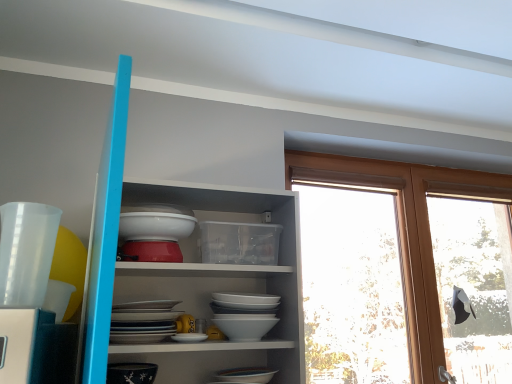
Question: Would you say black glossy bowl at lower left, which appears as the 2th tableware when viewed from the top, is outside white glossy shelves at upper center?

Choices:
 (A) no
 (B) yes

Answer: (A)

Question: Can you confirm if black glossy bowl at lower left, the second tableware in the front-to-back sequence, is thinner than white glossy shelves at upper center?

Choices:
 (A) no
 (B) yes

Answer: (B)

Question: Can you confirm if black glossy bowl at lower left, which appears as the 2th tableware when viewed from the top, is wider than white glossy shelves at upper center?

Choices:
 (A) no
 (B) yes

Answer: (A)

Question: Does black glossy bowl at lower left, the second tableware in the front-to-back sequence, have a greater height compared to white glossy shelves at upper center?

Choices:
 (A) no
 (B) yes

Answer: (A)

Question: Is black glossy bowl at lower left, the second tableware in the front-to-back sequence, at the right side of white glossy shelves at upper center?

Choices:
 (A) yes
 (B) no

Answer: (B)

Question: Considering the relative positions of transparent glass window at upper right and white glossy bowl at center in the image provided, is transparent glass window at upper right to the left or to the right of white glossy bowl at center?

Choices:
 (A) right
 (B) left

Answer: (A)

Question: In terms of size, does transparent glass window at upper right appear bigger or smaller than white glossy bowl at center?

Choices:
 (A) small
 (B) big

Answer: (B)

Question: Is transparent glass window at upper right spatially inside white glossy bowl at center, or outside of it?

Choices:
 (A) inside
 (B) outside

Answer: (B)

Question: From a real-world perspective, is transparent glass window at upper right positioned above or below white glossy bowl at center?

Choices:
 (A) below
 (B) above

Answer: (A)

Question: Looking at the image, does transparent glass window at upper right seem bigger or smaller compared to black glossy bowl at lower left, which ranks as the 1th tableware in bottom-to-top order?

Choices:
 (A) small
 (B) big

Answer: (B)

Question: Does point (435, 286) appear closer or farther from the camera than point (139, 365)?

Choices:
 (A) closer
 (B) farther

Answer: (B)

Question: From the image's perspective, relative to black glossy bowl at lower left, which ranks as the 1th tableware in bottom-to-top order, is transparent glass window at upper right above or below?

Choices:
 (A) below
 (B) above

Answer: (B)

Question: In terms of width, does transparent glass window at upper right look wider or thinner when compared to black glossy bowl at lower left, placed as the first tableware when sorted from back to front?

Choices:
 (A) wide
 (B) thin

Answer: (B)

Question: Is white glossy shelves at upper center taller or shorter than black glossy bowl at lower left, which appears as the 2th tableware when viewed from the top?

Choices:
 (A) tall
 (B) short

Answer: (A)

Question: From the image's perspective, relative to black glossy bowl at lower left, which ranks as the 1th tableware in bottom-to-top order, is white glossy shelves at upper center above or below?

Choices:
 (A) above
 (B) below

Answer: (A)